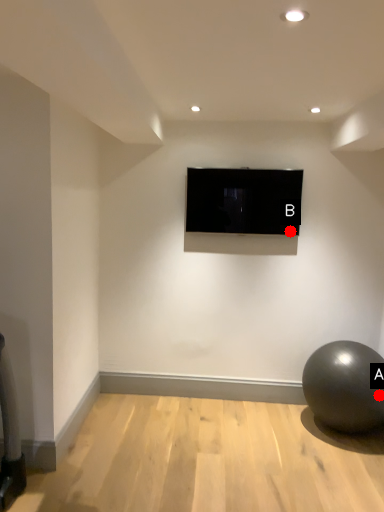
Question: Two points are circled on the image, labeled by A and B beside each circle. Which point appears farthest from the camera in this image?

Choices:
 (A) A is further
 (B) B is further

Answer: (B)